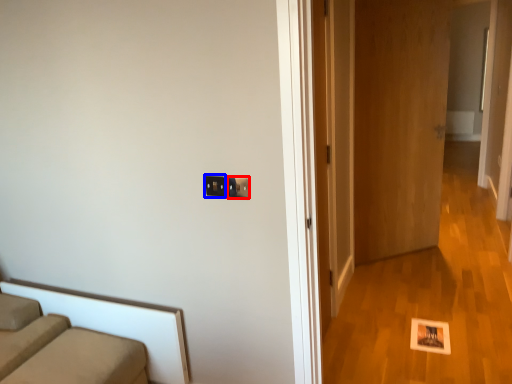
Question: Which object is closer to the camera taking this photo, electric outlet (highlighted by a red box) or electric outlet (highlighted by a blue box)?

Choices:
 (A) electric outlet
 (B) electric outlet

Answer: (A)